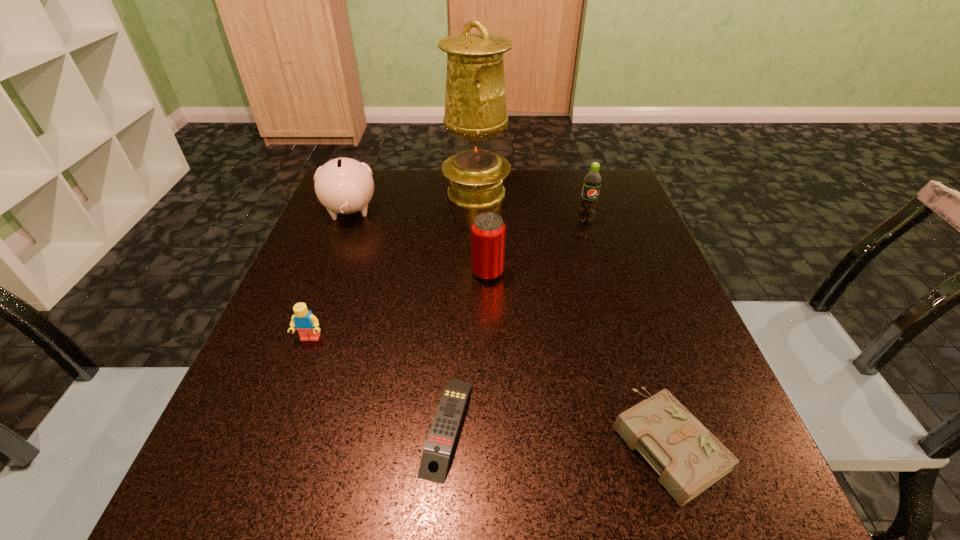
Where is `empty location between the piggy bank and the third shortest object`? empty location between the piggy bank and the third shortest object is located at coordinates (330, 275).

Identify the location of unoccupied position between the third nearest object and the second shortest object. [x=489, y=390].

Locate an element on the screen. The width and height of the screenshot is (960, 540). empty space that is in between the piggy bank and the fifth tallest object is located at coordinates (330, 275).

Find the location of a particular element. The height and width of the screenshot is (540, 960). empty space between the fifth tallest object and the soda is located at coordinates (447, 280).

Identify which object is the third closest to the third shortest object. Please provide its 2D coordinates. Your answer should be formatted as a tuple, i.e. [(x, y)], where the tuple contains the x and y coordinates of a point satisfying the conditions above.

[(343, 185)]

Select which object appears as the fifth closest to the sixth tallest object. Please provide its 2D coordinates. Your answer should be formatted as a tuple, i.e. [(x, y)], where the tuple contains the x and y coordinates of a point satisfying the conditions above.

[(475, 101)]

The width and height of the screenshot is (960, 540). Find the location of `free space that satisfies the following two spatial constraints: 1. on the front side of the fourth nearest object; 2. on the left side of the diary`. free space that satisfies the following two spatial constraints: 1. on the front side of the fourth nearest object; 2. on the left side of the diary is located at coordinates (491, 442).